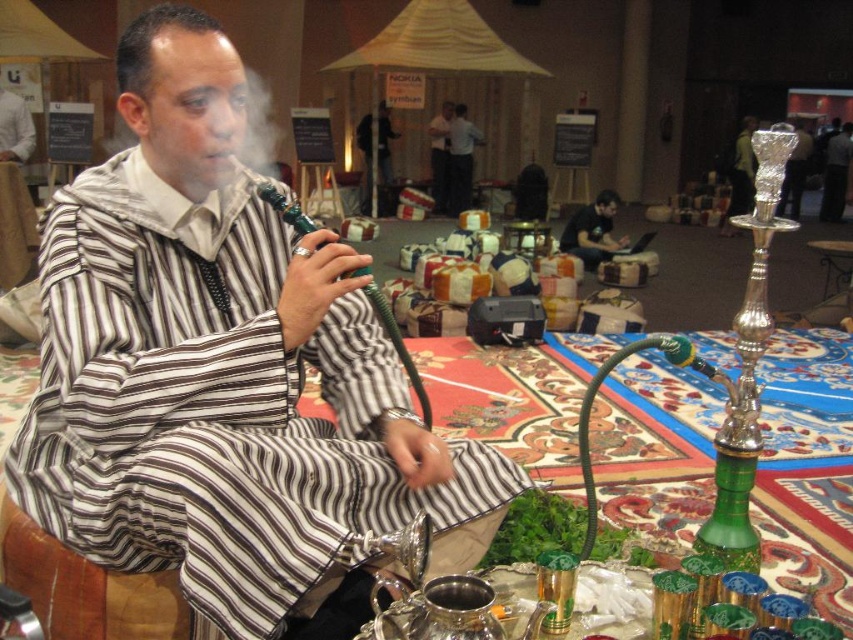
Question: In this image, where is dark gray fabric shirt at center located relative to matte black laptop at center?

Choices:
 (A) left
 (B) right

Answer: (B)

Question: Which of the following is the closest to the observer?

Choices:
 (A) (434, 492)
 (B) (454, 113)
 (C) (444, 102)

Answer: (A)

Question: Which object is closer to the camera taking this photo?

Choices:
 (A) striped fabric man at center
 (B) matte black laptop at center

Answer: (A)

Question: Is dark blue fabric at center positioned behind white shirt at center?

Choices:
 (A) yes
 (B) no

Answer: (B)

Question: Does matte black laptop at center have a smaller size compared to dark blue fabric at center?

Choices:
 (A) no
 (B) yes

Answer: (B)

Question: Which object appears closest to the camera in this image?

Choices:
 (A) striped fabric man at center
 (B) matte black laptop at center
 (C) white shirt at center
 (D) dark gray fabric shirt at center

Answer: (A)